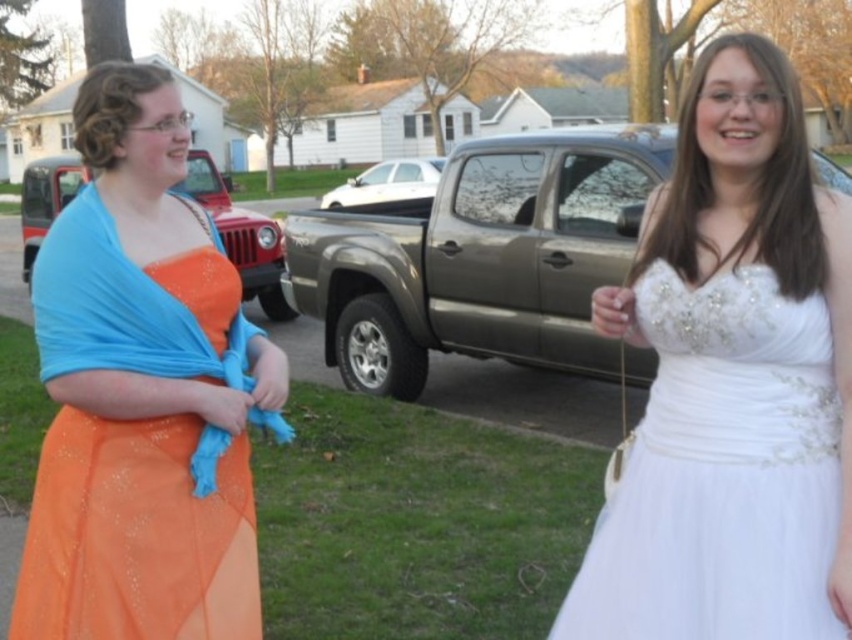
Question: Does white satin dress at center have a smaller size compared to orange satin dress at left?

Choices:
 (A) no
 (B) yes

Answer: (B)

Question: Among these points, which one is farthest from the camera?

Choices:
 (A) (122, 129)
 (B) (770, 636)

Answer: (A)

Question: Which point appears closest to the camera in this image?

Choices:
 (A) (753, 449)
 (B) (116, 106)

Answer: (A)

Question: Does white satin dress at center have a lesser width compared to orange satin dress at left?

Choices:
 (A) no
 (B) yes

Answer: (B)

Question: Is white satin dress at center further to the viewer compared to orange satin dress at left?

Choices:
 (A) no
 (B) yes

Answer: (A)